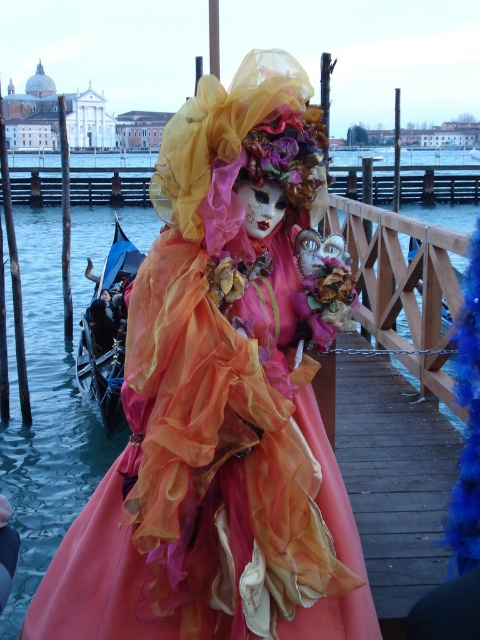
Question: Does matte orange fabric doll at center have a smaller size compared to black wood boat at left?

Choices:
 (A) no
 (B) yes

Answer: (B)

Question: Where is matte orange fabric doll at center located in relation to black wood boat at left in the image?

Choices:
 (A) below
 (B) above

Answer: (A)

Question: Which object is closer to the camera taking this photo?

Choices:
 (A) matte orange fabric doll at center
 (B) black wood boat at left

Answer: (A)

Question: Among these points, which one is nearest to the camera?

Choices:
 (A) (x=351, y=604)
 (B) (x=108, y=280)

Answer: (A)

Question: Can you confirm if matte orange fabric doll at center is thinner than black wood boat at left?

Choices:
 (A) no
 (B) yes

Answer: (A)

Question: Which of the following is the farthest from the observer?

Choices:
 (A) matte orange fabric doll at center
 (B) black wood boat at left

Answer: (B)